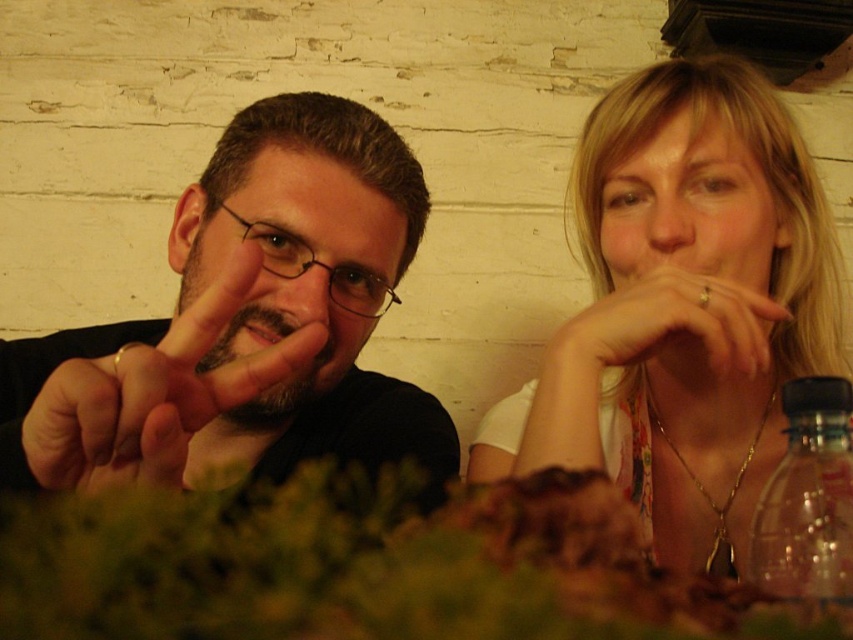
You are a photographer trying to capture a closeup of the clear plastic bottle at right while ensuring the blonde hair at upper right doesn t block the view. Based on their sizes, which object should you focus on first to avoid obstruction?

The blonde hair at upper right is larger than the clear plastic bottle at right, so focusing on the clear plastic bottle at right first would help avoid obstruction from the larger blonde hair at upper right.

You are a photographer trying to capture both the matte black shirt at left and the clear plastic bottle at right in a single frame. Given their sizes, which object should you focus on to ensure both are clearly visible in the photo?

The matte black shirt at left is larger in size than the clear plastic bottle at right, so focusing on the matte black shirt at left will help ensure both objects are clearly visible in the photo.